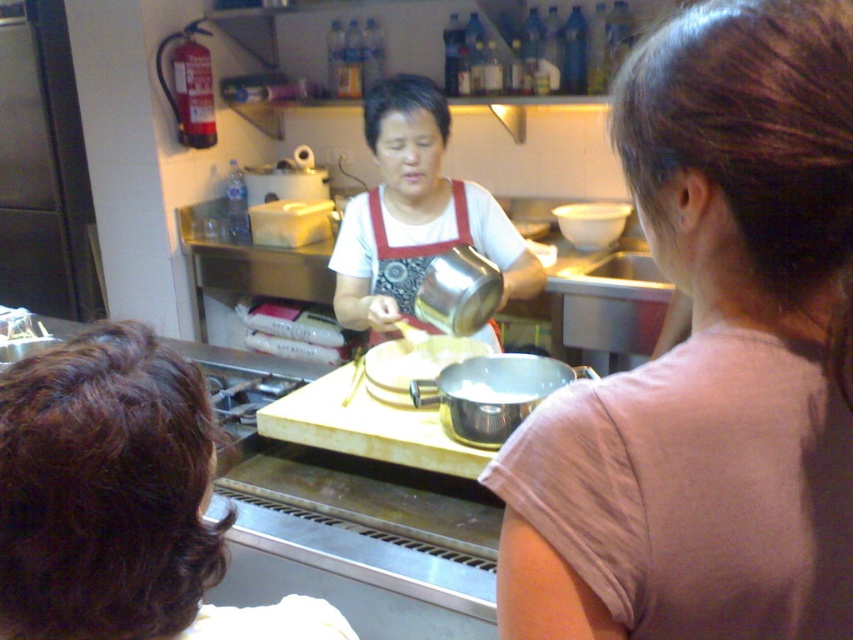
You are a guest in the kitchen and want to ask the person with the brown curly hair at lower left a question. To do so, you need to move around the matte white apron at center. Is the path clear to reach them?

The matte white apron at center is located above brown curly hair at lower left, so the apron is blocking the direct path. You would need to go around it to reach the person with brown curly hair at lower left.

Based on the scene described, which object, the matte white apron at center or the brown curly hair at lower left, takes up more space in the image?

The matte white apron at center has a larger size compared to the brown curly hair at lower left, so it takes up more space in the image.